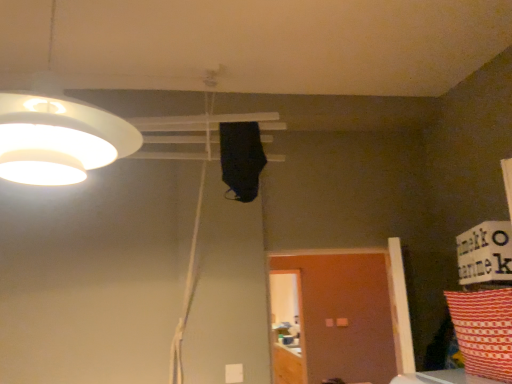
Question: In terms of height, does red and white patterned pillow at lower right look taller or shorter compared to brown matte door at lower right?

Choices:
 (A) short
 (B) tall

Answer: (A)

Question: Looking at their shapes, would you say red and white patterned pillow at lower right is wider or thinner than brown matte door at lower right?

Choices:
 (A) thin
 (B) wide

Answer: (B)

Question: Estimate the real-world distances between objects in this image. Which object is farther from the brown matte door at lower right?

Choices:
 (A) white matte lampshade at upper left
 (B) red and white patterned pillow at lower right

Answer: (A)

Question: Which of these objects is positioned farthest from the brown matte door at lower right?

Choices:
 (A) white matte lampshade at upper left
 (B) red and white patterned pillow at lower right

Answer: (A)